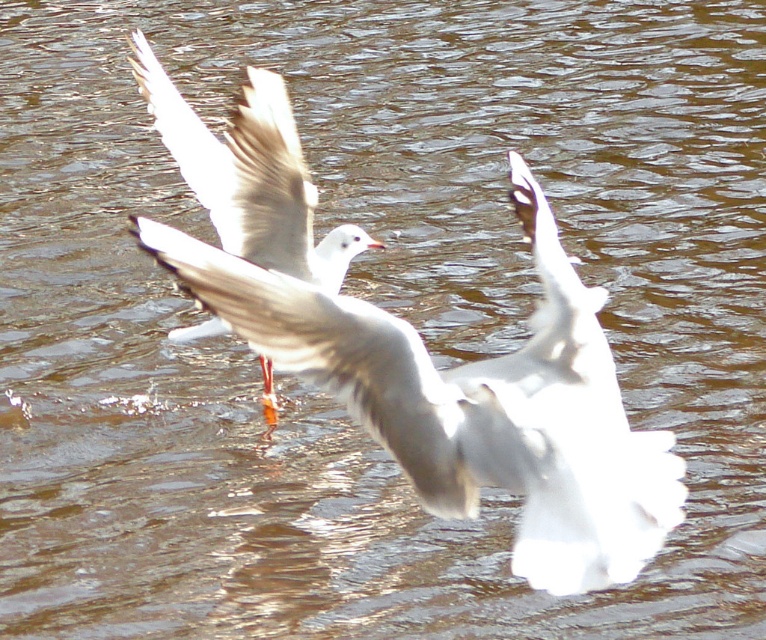
Question: Is white feathered wing at center in front of white feathered bird at center?

Choices:
 (A) no
 (B) yes

Answer: (B)

Question: Which point is farther from the camera taking this photo?

Choices:
 (A) (175, 269)
 (B) (270, 244)

Answer: (B)

Question: Is white feathered wing at center smaller than white feathered bird at center?

Choices:
 (A) no
 (B) yes

Answer: (B)

Question: Can you confirm if white feathered wing at center is positioned below white feathered bird at center?

Choices:
 (A) no
 (B) yes

Answer: (B)